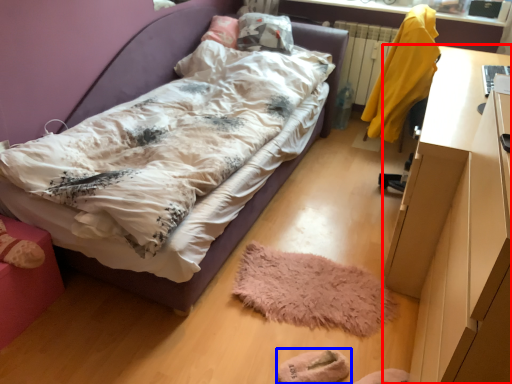
Question: Among these objects, which one is nearest to the camera, desk (highlighted by a red box) or footwear (highlighted by a blue box)?

Choices:
 (A) desk
 (B) footwear

Answer: (A)